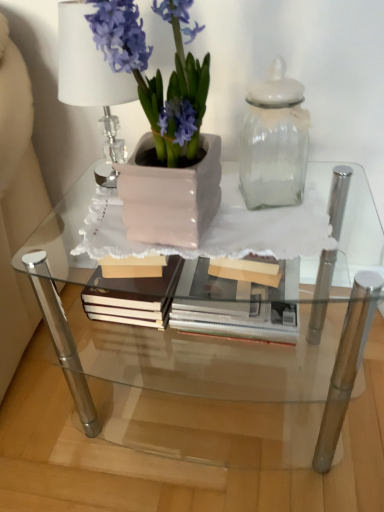
Question: Relative to clear crystal table lamp at upper left, is clear glass table at center in front or behind?

Choices:
 (A) behind
 (B) front

Answer: (B)

Question: From the image's perspective, is clear glass table at center above or below clear crystal table lamp at upper left?

Choices:
 (A) below
 (B) above

Answer: (A)

Question: Considering the real-world distances, which object is farthest from the transparent glass jar at upper right?

Choices:
 (A) clear crystal table lamp at upper left
 (B) clear glass table at center
 (C) matte pink pot at left

Answer: (B)

Question: Which of these objects is positioned farthest from the matte pink pot at left?

Choices:
 (A) transparent glass jar at upper right
 (B) clear crystal table lamp at upper left
 (C) clear glass table at center

Answer: (C)